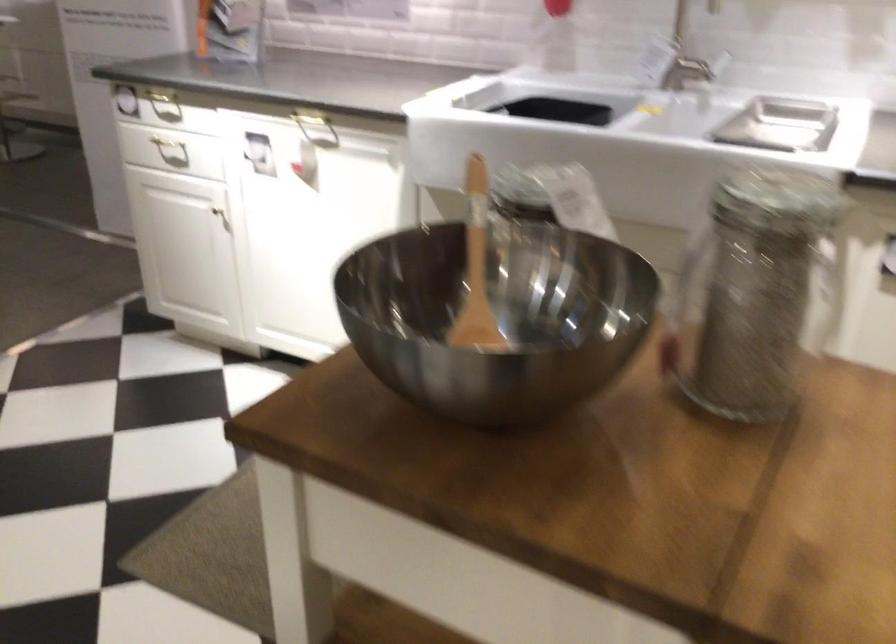
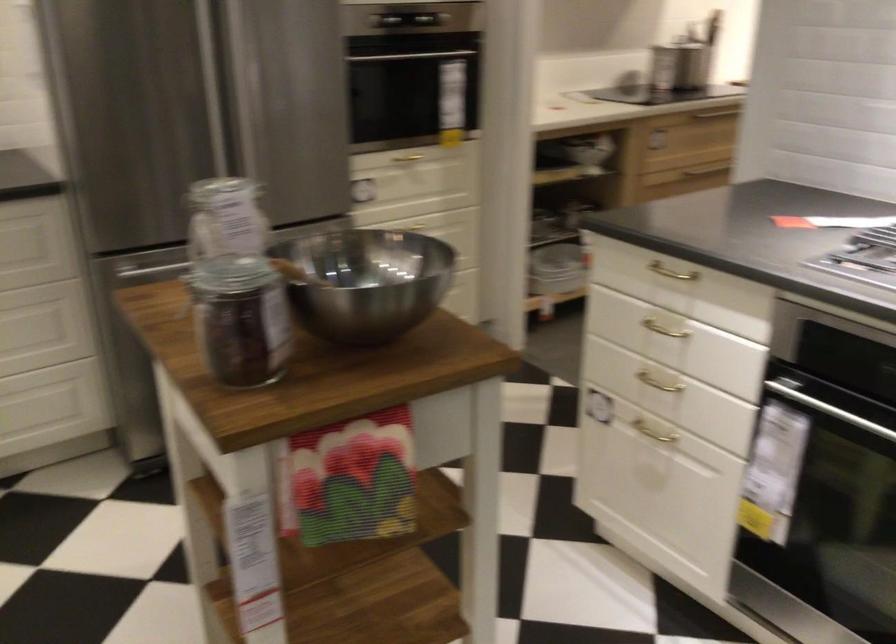
Where in the second image is the point corresponding to (x=485, y=399) from the first image?

(366, 281)